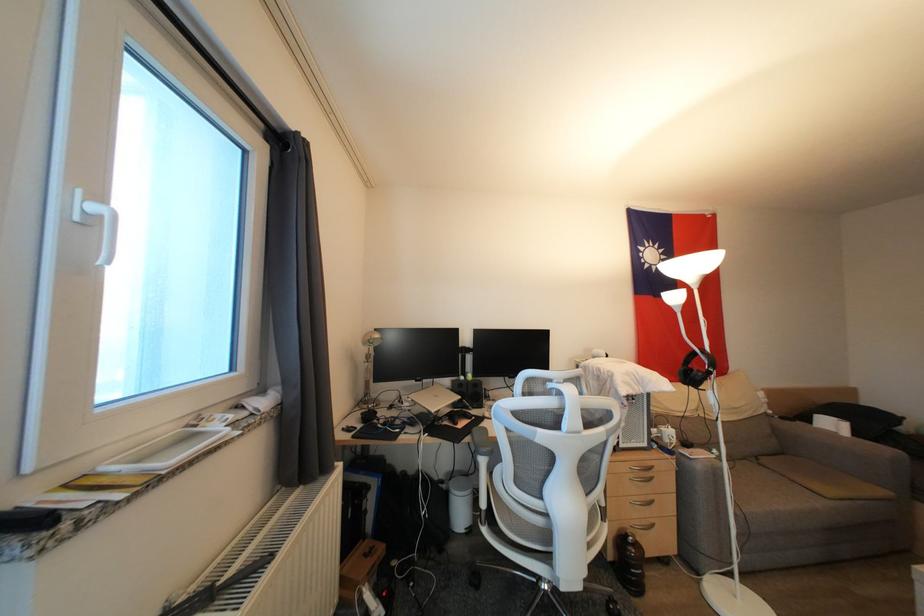
I want to click on white trash can, so click(459, 504).